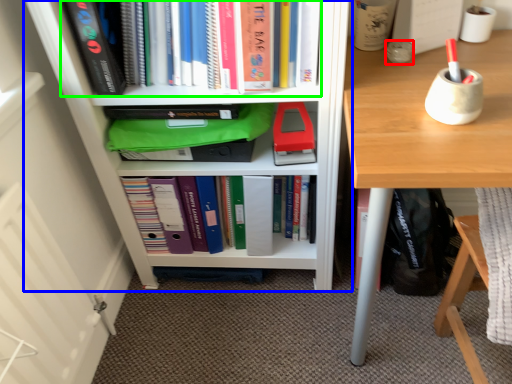
Question: Which object is the closest to the stationery (highlighted by a red box)? Choose among these: bookcase (highlighted by a blue box) or book (highlighted by a green box).

Choices:
 (A) bookcase
 (B) book

Answer: (B)